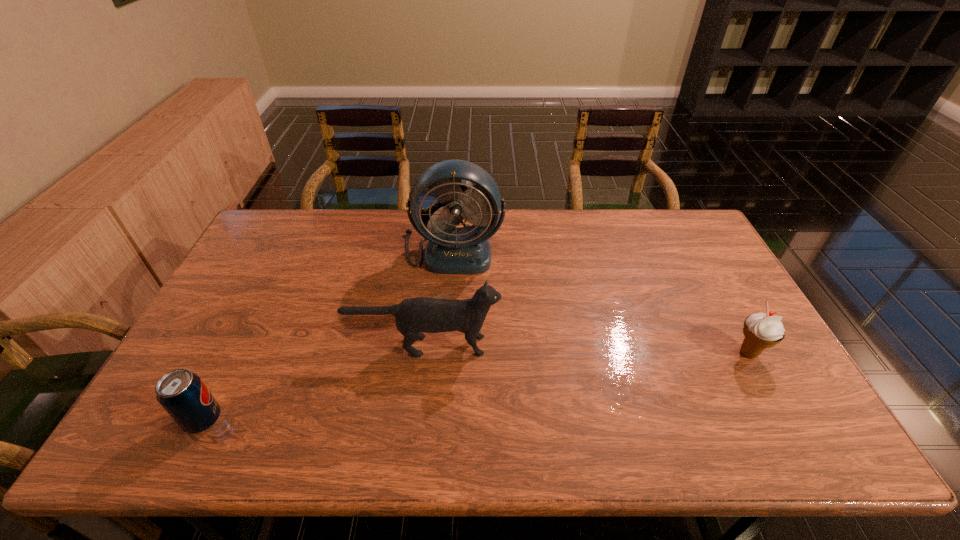
I want to click on the tallest object, so coord(465,250).

Locate an element on the screen. fan is located at coordinates (465, 250).

The image size is (960, 540). Identify the location of the third shortest object. (422, 314).

Where is `the rightmost object`? The image size is (960, 540). the rightmost object is located at coordinates (761, 330).

You are a GUI agent. You are given a task and a screenshot of the screen. Output one action in this format:
    pyautogui.click(x=<x>, y=<y>)
    Task: Click on the leftmost object
    
    Given the screenshot: What is the action you would take?
    pyautogui.click(x=184, y=396)

Where is `the nearest object`? This screenshot has width=960, height=540. the nearest object is located at coordinates 184,396.

The width and height of the screenshot is (960, 540). In order to click on free space located 0.150m in front of the tallest object to blow air in this screenshot , I will do `click(448, 309)`.

The height and width of the screenshot is (540, 960). What are the coordinates of `vacant region located on the front-facing side of the third shortest object` in the screenshot? It's located at (617, 346).

You are a GUI agent. You are given a task and a screenshot of the screen. Output one action in this format:
    pyautogui.click(x=<x>, y=<y>)
    Task: Click on the free space located 0.310m on the left of the rightmost object
    The width and height of the screenshot is (960, 540).
    Given the screenshot: What is the action you would take?
    pyautogui.click(x=616, y=353)

The height and width of the screenshot is (540, 960). In order to click on vacant space located 0.120m on the back of the leftmost object in this screenshot , I will do `click(231, 363)`.